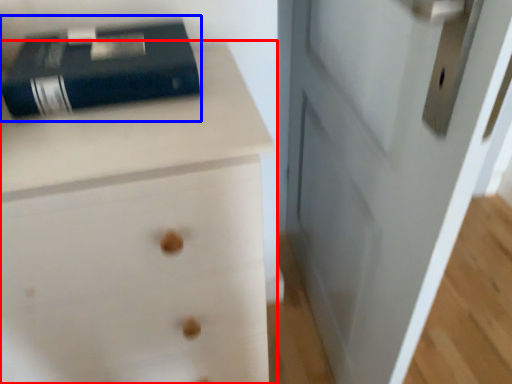
Question: Which object appears closest to the camera in this image, chest of drawers (highlighted by a red box) or paperback book (highlighted by a blue box)?

Choices:
 (A) chest of drawers
 (B) paperback book

Answer: (A)